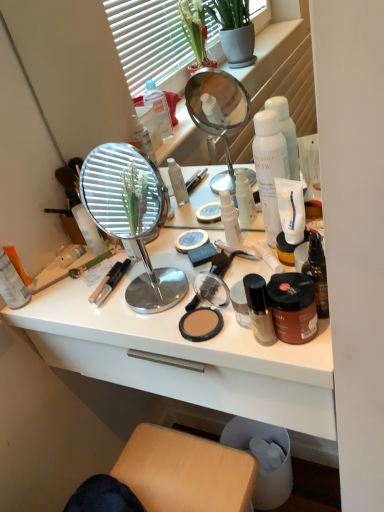
The height and width of the screenshot is (512, 384). What do you see at coordinates (76, 271) in the screenshot? I see `matte black brush at lower left` at bounding box center [76, 271].

The width and height of the screenshot is (384, 512). What do you see at coordinates (200, 323) in the screenshot?
I see `matte black compact at center` at bounding box center [200, 323].

Locate an element on the screen. Image resolution: width=384 pixels, height=512 pixels. matte black compact at center is located at coordinates (200, 323).

What is the approximate height of white matte spray can at center right, which is the second product in bottom-to-top order?

The height of white matte spray can at center right, which is the second product in bottom-to-top order, is 9.76 inches.

Looking at this image, measure the distance between white matte tube at center-right, which is the 2th product in top-to-bottom order, and camera.

They are 69.52 centimeters apart.

Find the location of a particular element. This screenshot has height=512, width=384. white glossy desk at center is located at coordinates (184, 353).

This screenshot has width=384, height=512. Identify the location of white matte pump bottle at center, the 2th toiletry positioned from the left. (230, 219).

Is matte black compact at center wider than white matte tube at center-right, placed as the first product when sorted from bottom to top?

Yes, matte black compact at center is wider than white matte tube at center-right, placed as the first product when sorted from bottom to top.

From a real-world perspective, which is physically above, matte black compact at center or white matte tube at center-right, which is the 2th product in top-to-bottom order?

white matte tube at center-right, which is the 2th product in top-to-bottom order.

Is matte black compact at center not near white matte tube at center-right, which is the 2th product in top-to-bottom order?

No.

Is white glossy desk at center inside or outside of matte black compact at center?

white glossy desk at center lies outside matte black compact at center.

From a real-world perspective, is white glossy desk at center physically above matte black compact at center?

No, from a real-world perspective, white glossy desk at center is not on top of matte black compact at center.

Is white glossy desk at center wider than matte black compact at center?

Yes.

Are white glossy desk at center and matte black compact at center far apart?

That's not correct — white glossy desk at center is a little close to matte black compact at center.

Does white glossy desk at center lie in front of matte black brush at lower left?

Yes, it is in front of matte black brush at lower left.

From a real-world perspective, between white glossy desk at center and matte black brush at lower left, who is vertically higher?

In real-world perspective, matte black brush at lower left is above.

Looking at this image, can you confirm if white glossy desk at center is wider than matte black brush at lower left?

Yes, white glossy desk at center is wider than matte black brush at lower left.

Visually, is white matte tube at center-right, placed as the first product when sorted from bottom to top, positioned to the left or to the right of orange matte lotion at left, the 5th toiletry positioned from the right?

Based on their positions, white matte tube at center-right, placed as the first product when sorted from bottom to top, is located to the right of orange matte lotion at left, the 5th toiletry positioned from the right.

Can you tell me how much white matte tube at center-right, placed as the first product when sorted from bottom to top, and orange matte lotion at left, positioned as the first toiletry in left-to-right order, differ in facing direction?

The angle between the facing direction of white matte tube at center-right, placed as the first product when sorted from bottom to top, and the facing direction of orange matte lotion at left, positioned as the first toiletry in left-to-right order, is 29.6 degrees.

Who is taller, white matte tube at center-right, which is the 2th product in top-to-bottom order, or orange matte lotion at left, the 5th toiletry positioned from the right?

orange matte lotion at left, the 5th toiletry positioned from the right.

Does white matte tube at center-right, which is the 2th product in top-to-bottom order, turn towards orange matte lotion at left, positioned as the first toiletry in left-to-right order?

No, white matte tube at center-right, which is the 2th product in top-to-bottom order, is not facing towards orange matte lotion at left, positioned as the first toiletry in left-to-right order.

Is matte black brush at lower left looking in the opposite direction of shiny brown bottle at right, the 5th toiletry viewed from the left?

matte black brush at lower left does not have its back to shiny brown bottle at right, the 5th toiletry viewed from the left.

Is matte black brush at lower left inside or outside of shiny brown bottle at right, the 5th toiletry viewed from the left?

matte black brush at lower left lies outside shiny brown bottle at right, the 5th toiletry viewed from the left.

In the image, is matte black brush at lower left positioned in front of or behind shiny brown bottle at right, the 5th toiletry viewed from the left?

Visually, matte black brush at lower left is located behind shiny brown bottle at right, the 5th toiletry viewed from the left.

Based on the photo, considering the sizes of objects matte black brush at lower left and shiny brown bottle at right, which is the 1th toiletry in right-to-left order, in the image provided, who is smaller, matte black brush at lower left or shiny brown bottle at right, which is the 1th toiletry in right-to-left order,?

matte black brush at lower left is smaller.

Considering the relative positions of white matte tube at center-right, placed as the first product when sorted from bottom to top, and brown matte jar at center-right, the fourth toiletry positioned from the left, in the image provided, is white matte tube at center-right, placed as the first product when sorted from bottom to top, to the right of brown matte jar at center-right, the fourth toiletry positioned from the left, from the viewer's perspective?

Yes, white matte tube at center-right, placed as the first product when sorted from bottom to top, is to the right of brown matte jar at center-right, the fourth toiletry positioned from the left.

Is point (290, 203) less distant than point (289, 305)?

No, (290, 203) is behind (289, 305).

Is white matte tube at center-right, which is the 2th product in top-to-bottom order, positioned beyond the bounds of brown matte jar at center-right, which appears as the second toiletry when viewed from the right?

white matte tube at center-right, which is the 2th product in top-to-bottom order, lies outside brown matte jar at center-right, which appears as the second toiletry when viewed from the right,'s area.

Who is shorter, white matte tube at center-right, placed as the first product when sorted from bottom to top, or brown matte jar at center-right, which appears as the second toiletry when viewed from the right?

With less height is brown matte jar at center-right, which appears as the second toiletry when viewed from the right.

From a real-world perspective, who is located higher, matte black brush at lower left or white glossy desk at center?

matte black brush at lower left.

Does point (105, 255) appear closer or farther from the camera than point (80, 302)?

Point (105, 255) is farther from the camera than point (80, 302).

In the image, is matte black brush at lower left on the left side or the right side of white glossy desk at center?

matte black brush at lower left is positioned on white glossy desk at center's left side.

From the picture: Considering the sizes of objects matte black brush at lower left and white glossy desk at center in the image provided, who is wider, matte black brush at lower left or white glossy desk at center?

white glossy desk at center.

You are a GUI agent. You are given a task and a screenshot of the screen. Output one action in this format:
    pyautogui.click(x=<x>, y=<y>)
    Task: Click on the 1st product behind the matte black compact at center, counting from the anchor's position
    The height and width of the screenshot is (512, 384).
    Given the screenshot: What is the action you would take?
    pyautogui.click(x=291, y=209)

This screenshot has height=512, width=384. I want to click on desk located on the left of matte black compact at center, so click(184, 353).

Looking at the image, which one is located further to white matte spray can at center right, the first product positioned from the top, white matte pump bottle at center, the 2th toiletry positioned from the left, or matte black compact at center?

matte black compact at center is further to white matte spray can at center right, the first product positioned from the top.

When comparing their distances from matte black compact at center, does white matte spray can at center right, the first product positioned from the top, or shiny brown bottle at right, the 5th toiletry viewed from the left, seem closer?

shiny brown bottle at right, the 5th toiletry viewed from the left, is positioned closer to the anchor matte black compact at center.

Considering their positions, is white matte spray can at center right, which is the second product in bottom-to-top order, positioned closer to orange matte lotion at left, positioned as the first toiletry in left-to-right order, than shiny brown bottle at right, which is the 1th toiletry in right-to-left order?

Based on the image, white matte spray can at center right, which is the second product in bottom-to-top order, appears to be nearer to orange matte lotion at left, positioned as the first toiletry in left-to-right order.

Considering their positions, is shiny brown bottle at right, which is the 1th toiletry in right-to-left order, positioned further to orange matte lotion at left, positioned as the first toiletry in left-to-right order, than matte black brush at lower left?

shiny brown bottle at right, which is the 1th toiletry in right-to-left order, is further to orange matte lotion at left, positioned as the first toiletry in left-to-right order.

Which object lies further to the anchor point orange matte lotion at left, positioned as the first toiletry in left-to-right order, white matte pump bottle at center, which appears as the 4th toiletry when viewed from the right, or brown matte jar at center-right, which appears as the second toiletry when viewed from the right?

brown matte jar at center-right, which appears as the second toiletry when viewed from the right.

Which object lies nearer to the anchor point shiny brown bottle at right, which is the 1th toiletry in right-to-left order, white glossy desk at center or white matte pump bottle at center, the 2th toiletry positioned from the left?

Based on the image, white matte pump bottle at center, the 2th toiletry positioned from the left, appears to be nearer to shiny brown bottle at right, which is the 1th toiletry in right-to-left order.

When comparing their distances from white matte spray can at center right, which is the second product in bottom-to-top order, does white matte tube at center-right, which is the 2th product in top-to-bottom order, or silver/metallic mirror at center seem closer?

Based on the image, white matte tube at center-right, which is the 2th product in top-to-bottom order, appears to be nearer to white matte spray can at center right, which is the second product in bottom-to-top order.

Considering their positions, is orange matte lotion at left, positioned as the first toiletry in left-to-right order, positioned further to white glossy desk at center than white matte tube at center-right, placed as the first product when sorted from bottom to top?

The object further to white glossy desk at center is white matte tube at center-right, placed as the first product when sorted from bottom to top.

You are a GUI agent. You are given a task and a screenshot of the screen. Output one action in this format:
    pyautogui.click(x=<x>, y=<y>)
    Task: Click on the toiletry located between matte black brush at lower left and matte black foundation at center, placed as the 3th toiletry when sorted from left to right, in the left-right direction
    
    Given the screenshot: What is the action you would take?
    pyautogui.click(x=230, y=219)

This screenshot has height=512, width=384. Find the location of `face powder between white matte tube at center-right, which is the 2th product in top-to-bottom order, and white glossy desk at center vertically`. face powder between white matte tube at center-right, which is the 2th product in top-to-bottom order, and white glossy desk at center vertically is located at coordinates (200, 323).

Where is `desk between silver/metallic mirror at center and white matte spray can at center right, the first product positioned from the top, in the horizontal direction`? Image resolution: width=384 pixels, height=512 pixels. desk between silver/metallic mirror at center and white matte spray can at center right, the first product positioned from the top, in the horizontal direction is located at coordinates (184, 353).

Identify the location of face powder between matte black brush at lower left and white matte pump bottle at center, the 2th toiletry positioned from the left, from left to right. The width and height of the screenshot is (384, 512). (200, 323).